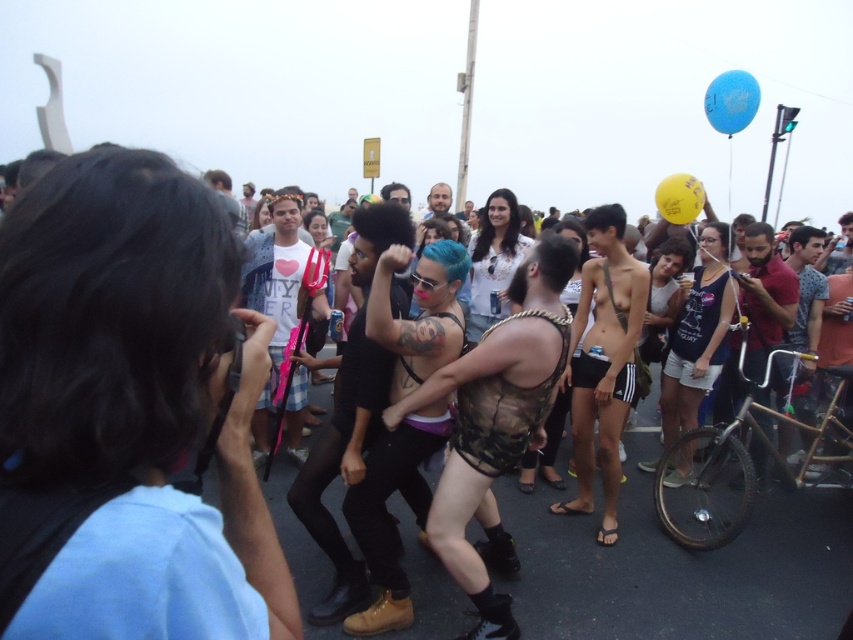
Question: Which point is closer to the camera?

Choices:
 (A) (328, 291)
 (B) (769, 305)
 (C) (219, 358)

Answer: (C)

Question: Among these objects, which one is farthest from the camera?

Choices:
 (A) matte white shirt at center
 (B) light brown hair at center
 (C) camouflage fabric vest at center
 (D) red shirt at center

Answer: (A)

Question: From the image, what is the correct spatial relationship of denim shorts at center in relation to white floral shirt at center?

Choices:
 (A) below
 (B) above

Answer: (A)

Question: Considering the relative positions of white matte t-shirt at center and matte white shirt at center in the image provided, where is white matte t-shirt at center located with respect to matte white shirt at center?

Choices:
 (A) above
 (B) below

Answer: (B)

Question: Can you confirm if white matte t-shirt at center is positioned above white floral shirt at center?

Choices:
 (A) yes
 (B) no

Answer: (B)

Question: Which of the following is the farthest from the observer?

Choices:
 (A) (108, 547)
 (B) (315, 339)
 (C) (695, 368)

Answer: (B)